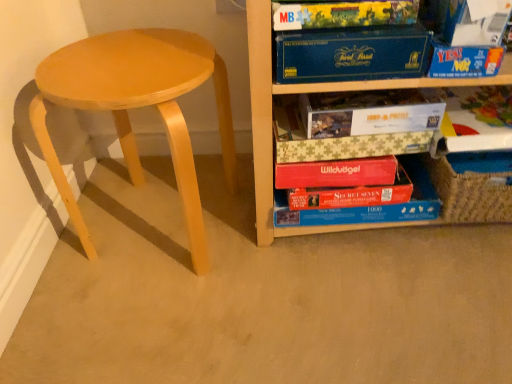
Question: From the image's perspective, is yellow cardboard puzzle box at upper center, which is the 3th paperback book in bottom-to-top order, located beneath light wood stool at left?

Choices:
 (A) no
 (B) yes

Answer: (A)

Question: Does yellow cardboard puzzle box at upper center, which ranks as the 2th paperback book in top-to-bottom order, come in front of light wood stool at left?

Choices:
 (A) no
 (B) yes

Answer: (A)

Question: From a real-world perspective, does yellow cardboard puzzle box at upper center, which ranks as the 2th paperback book in top-to-bottom order, sit lower than light wood stool at left?

Choices:
 (A) no
 (B) yes

Answer: (A)

Question: Considering the relative sizes of yellow cardboard puzzle box at upper center, which is the 3th paperback book in bottom-to-top order, and light wood stool at left in the image provided, is yellow cardboard puzzle box at upper center, which is the 3th paperback book in bottom-to-top order, thinner than light wood stool at left?

Choices:
 (A) no
 (B) yes

Answer: (B)

Question: Are yellow cardboard puzzle box at upper center, which is the 3th paperback book in bottom-to-top order, and light wood stool at left making contact?

Choices:
 (A) yes
 (B) no

Answer: (B)

Question: Is yellow cardboard puzzle box at upper center, which is the 3th paperback book in bottom-to-top order, not close to light wood stool at left?

Choices:
 (A) yes
 (B) no

Answer: (B)

Question: Considering the relative sizes of red cardboard puzzle box at lower center, the second book positioned from the right, and matte cardboard book at upper right, the 1th book viewed from the top, in the image provided, is red cardboard puzzle box at lower center, the second book positioned from the right, smaller than matte cardboard book at upper right, the 1th book viewed from the top,?

Choices:
 (A) yes
 (B) no

Answer: (B)

Question: Considering the relative sizes of red cardboard puzzle box at lower center, the second book positioned from the right, and matte cardboard book at upper right, the 1th book viewed from the top, in the image provided, is red cardboard puzzle box at lower center, the second book positioned from the right, shorter than matte cardboard book at upper right, the 1th book viewed from the top,?

Choices:
 (A) no
 (B) yes

Answer: (A)

Question: From the image's perspective, is red cardboard puzzle box at lower center, the first book in the bottom-to-top sequence, located above matte cardboard book at upper right, the first book viewed from the right?

Choices:
 (A) no
 (B) yes

Answer: (A)

Question: Does red cardboard puzzle box at lower center, the 1th book viewed from the left, lie behind matte cardboard book at upper right, the 1th book viewed from the top?

Choices:
 (A) no
 (B) yes

Answer: (B)

Question: From a real-world perspective, is red cardboard puzzle box at lower center, marked as the second book in a top-to-bottom arrangement, on top of matte cardboard book at upper right, the first book viewed from the right?

Choices:
 (A) yes
 (B) no

Answer: (B)

Question: Does red cardboard puzzle box at lower center, the first book in the bottom-to-top sequence, have a lesser width compared to matte cardboard book at upper right, which ranks as the 2th book in bottom-to-top order?

Choices:
 (A) no
 (B) yes

Answer: (B)

Question: From the image's perspective, is white paper at upper right, which is the first paperback book in top-to-bottom order, beneath yellow cardboard puzzle box at upper center, which is the 3th paperback book in bottom-to-top order?

Choices:
 (A) no
 (B) yes

Answer: (A)